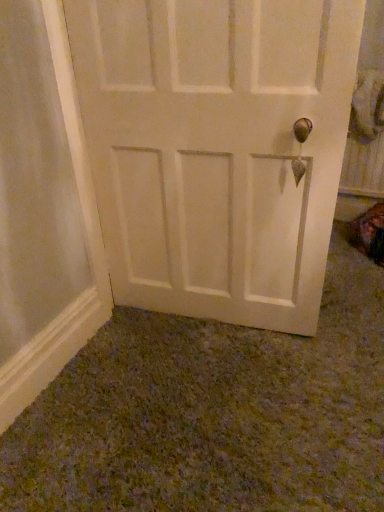
The height and width of the screenshot is (512, 384). I want to click on free location in front of white matte door at center, so click(x=210, y=399).